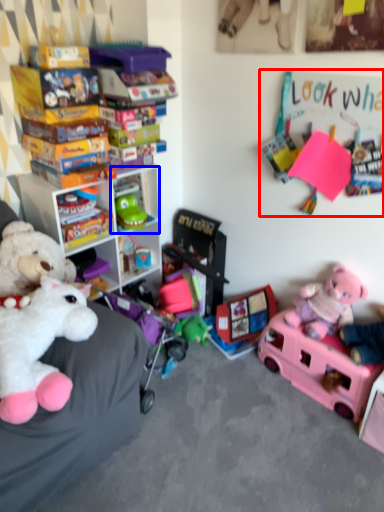
Question: Among these objects, which one is farthest to the camera, bulletin board (highlighted by a red box) or shelf (highlighted by a blue box)?

Choices:
 (A) bulletin board
 (B) shelf

Answer: (B)